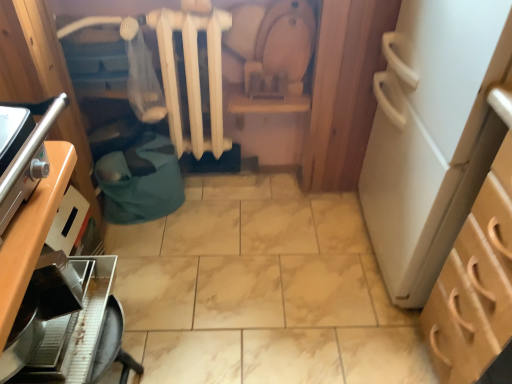
Locate an element on the screen. This screenshot has width=512, height=384. empty space that is ontop of white matte radiator at center (from a real-world perspective) is located at coordinates (196, 6).